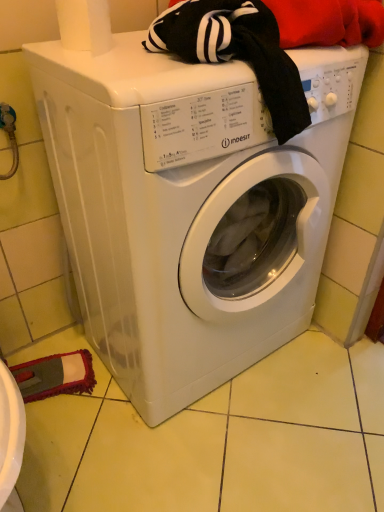
Question: From the image's perspective, relative to white paper towel at upper left, is white plastic washing machine at center above or below?

Choices:
 (A) below
 (B) above

Answer: (A)

Question: Is point (208, 268) positioned closer to the camera than point (56, 3)?

Choices:
 (A) closer
 (B) farther

Answer: (B)

Question: Relative to white paper towel at upper left, is white plastic washing machine at center in front or behind?

Choices:
 (A) front
 (B) behind

Answer: (A)

Question: Is white paper towel at upper left situated inside white plastic washing machine at center or outside?

Choices:
 (A) inside
 (B) outside

Answer: (B)

Question: In terms of height, does white paper towel at upper left look taller or shorter compared to white plastic washing machine at center?

Choices:
 (A) tall
 (B) short

Answer: (B)

Question: Is white paper towel at upper left in front of or behind white plastic washing machine at center in the image?

Choices:
 (A) behind
 (B) front

Answer: (A)

Question: Is point (89, 8) closer or farther from the camera than point (327, 159)?

Choices:
 (A) closer
 (B) farther

Answer: (A)